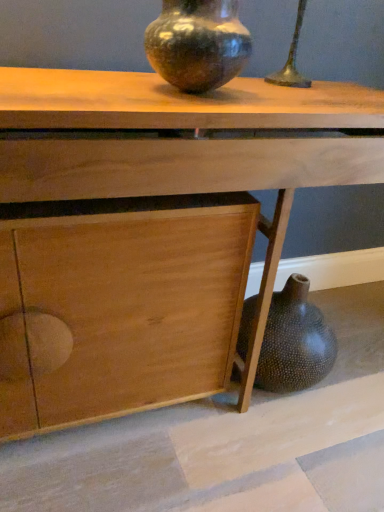
I want to click on free space to the right of speckled dark brown vase at upper center, so click(283, 99).